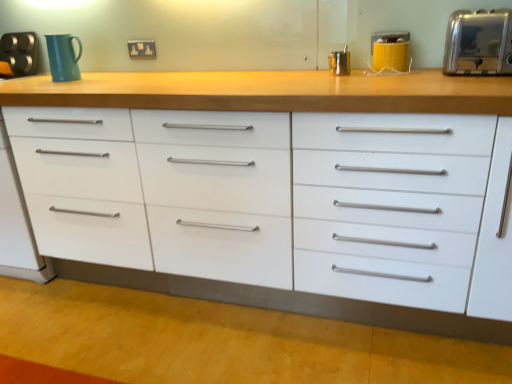
How much space does satin silver toaster at upper right, which is the 4th appliance from left to right, occupy vertically?

The height of satin silver toaster at upper right, which is the 4th appliance from left to right, is 7.89 inches.

What are the coordinates of `brushed metal toaster at upper left, positioned as the first appliance in left-to-right order` in the screenshot? It's located at (19, 52).

What do you see at coordinates (390, 50) in the screenshot? The width and height of the screenshot is (512, 384). I see `yellow matte toaster at upper right, which is the 2th appliance from front to back` at bounding box center [390, 50].

This screenshot has height=384, width=512. I want to click on satin silver toaster at upper right, which is the first appliance from right to left, so click(x=479, y=43).

Consider the image. Is matte plastic electric outlet at upper center aimed at brushed metal toaster at upper left, positioned as the first appliance in left-to-right order?

No, matte plastic electric outlet at upper center is not aimed at brushed metal toaster at upper left, positioned as the first appliance in left-to-right order.

Is matte plastic electric outlet at upper center located outside brushed metal toaster at upper left, marked as the 4th appliance in a front-to-back arrangement?

Indeed, matte plastic electric outlet at upper center is completely outside brushed metal toaster at upper left, marked as the 4th appliance in a front-to-back arrangement.

Looking at their sizes, would you say matte plastic electric outlet at upper center is wider or thinner than brushed metal toaster at upper left, positioned as the first appliance in back-to-front order?

Considering their sizes, matte plastic electric outlet at upper center looks slimmer than brushed metal toaster at upper left, positioned as the first appliance in back-to-front order.

Can you confirm if matte plastic electric outlet at upper center is smaller than brushed metal toaster at upper left, positioned as the first appliance in back-to-front order?

Yes.

Would you say satin silver toaster at upper right, which is the 4th appliance from left to right, is part of matte plastic electric outlet at upper center's contents?

That's incorrect, satin silver toaster at upper right, which is the 4th appliance from left to right, is not inside matte plastic electric outlet at upper center.

Is matte plastic electric outlet at upper center oriented towards satin silver toaster at upper right, which is the first appliance from right to left?

No.

Is matte plastic electric outlet at upper center in front of satin silver toaster at upper right, which is the 4th appliance from left to right?

No, matte plastic electric outlet at upper center is behind satin silver toaster at upper right, which is the 4th appliance from left to right.

Can you confirm if matte plastic electric outlet at upper center is wider than satin silver toaster at upper right, which is the 4th appliance from back to front?

In fact, matte plastic electric outlet at upper center might be narrower than satin silver toaster at upper right, which is the 4th appliance from back to front.

Based on the photo, is white glossy chest of drawers at center to the right of metallic silver container at upper center, which ranks as the 2th appliance in back-to-front order, from the viewer's perspective?

No, white glossy chest of drawers at center is not to the right of metallic silver container at upper center, which ranks as the 2th appliance in back-to-front order.

Could you tell me if white glossy chest of drawers at center is turned towards metallic silver container at upper center, which is counted as the 3th appliance, starting from the right?

No, white glossy chest of drawers at center is not turned towards metallic silver container at upper center, which is counted as the 3th appliance, starting from the right.

Consider the image. Would you say white glossy chest of drawers at center is a long distance from metallic silver container at upper center, the second appliance when ordered from left to right?

That's not correct — white glossy chest of drawers at center is a little close to metallic silver container at upper center, the second appliance when ordered from left to right.

From the image's perspective, is white glossy chest of drawers at center located above metallic silver container at upper center, which ranks as the 2th appliance in back-to-front order?

No, from the image's perspective, white glossy chest of drawers at center is not over metallic silver container at upper center, which ranks as the 2th appliance in back-to-front order.

Consider the image. From a real-world perspective, is matte plastic electric outlet at upper center positioned above or below metallic silver container at upper center, which is counted as the 3th appliance, starting from the right?

matte plastic electric outlet at upper center is above metallic silver container at upper center, which is counted as the 3th appliance, starting from the right.

Considering the sizes of objects matte plastic electric outlet at upper center and metallic silver container at upper center, the second appliance when ordered from left to right, in the image provided, who is shorter, matte plastic electric outlet at upper center or metallic silver container at upper center, the second appliance when ordered from left to right,?

Standing shorter between the two is matte plastic electric outlet at upper center.

At what (x,y) coordinates should I click in order to perform the action: click on electric outlet above the metallic silver container at upper center, which is counted as the 3th appliance, starting from the right (from a real-world perspective). Please return your answer as a coordinate pair (x, y). Image resolution: width=512 pixels, height=384 pixels. Looking at the image, I should click on click(142, 49).

Considering the positions of objects matte plastic electric outlet at upper center and metallic silver container at upper center, which ranks as the 2th appliance in back-to-front order, in the image provided, who is more to the left, matte plastic electric outlet at upper center or metallic silver container at upper center, which ranks as the 2th appliance in back-to-front order,?

matte plastic electric outlet at upper center.

Based on the photo, considering the sizes of objects matte teal mug at upper left and matte plastic electric outlet at upper center in the image provided, who is thinner, matte teal mug at upper left or matte plastic electric outlet at upper center?

matte plastic electric outlet at upper center.

Could you tell me if matte teal mug at upper left is turned towards matte plastic electric outlet at upper center?

No, matte teal mug at upper left is not oriented towards matte plastic electric outlet at upper center.

From the image's perspective, which object appears higher, matte teal mug at upper left or matte plastic electric outlet at upper center?

From the image's view, matte plastic electric outlet at upper center is above.

You are a GUI agent. You are given a task and a screenshot of the screen. Output one action in this format:
    pyautogui.click(x=<x>, y=<y>)
    Task: Click on the 2nd appliance behind the white glossy chest of drawers at center
    The image size is (512, 384).
    Given the screenshot: What is the action you would take?
    [x=390, y=50]

From a real-world perspective, who is located higher, yellow matte toaster at upper right, the second appliance in the right-to-left sequence, or white glossy chest of drawers at center?

yellow matte toaster at upper right, the second appliance in the right-to-left sequence.

Who is bigger, yellow matte toaster at upper right, the third appliance when ordered from back to front, or white glossy chest of drawers at center?

Bigger between the two is white glossy chest of drawers at center.

Is matte plastic electric outlet at upper center at the back of brushed metal toaster at upper left, positioned as the first appliance in back-to-front order?

No, matte plastic electric outlet at upper center is not at the back of brushed metal toaster at upper left, positioned as the first appliance in back-to-front order.

From a real-world perspective, is brushed metal toaster at upper left, positioned as the first appliance in back-to-front order, located beneath matte plastic electric outlet at upper center?

Yes.

Can you confirm if brushed metal toaster at upper left, marked as the fourth appliance in a right-to-left arrangement, is smaller than matte plastic electric outlet at upper center?

Incorrect, brushed metal toaster at upper left, marked as the fourth appliance in a right-to-left arrangement, is not smaller in size than matte plastic electric outlet at upper center.

Looking at this image, can we say brushed metal toaster at upper left, marked as the fourth appliance in a right-to-left arrangement, lies outside matte plastic electric outlet at upper center?

brushed metal toaster at upper left, marked as the fourth appliance in a right-to-left arrangement, is positioned outside matte plastic electric outlet at upper center.

At what (x,y) coordinates should I click in order to perform the action: click on appliance behind the matte plastic electric outlet at upper center. Please return your answer as a coordinate pair (x, y). Image resolution: width=512 pixels, height=384 pixels. Looking at the image, I should click on (19, 52).

At what (x,y) coordinates should I click in order to perform the action: click on appliance that is the 2nd object located below the matte plastic electric outlet at upper center (from the image's perspective). Please return your answer as a coordinate pair (x, y). The image size is (512, 384). Looking at the image, I should click on (479, 43).

When comparing their distances from matte teal mug at upper left, does metallic silver container at upper center, the 3th appliance when ordered from front to back, or white glossy chest of drawers at center seem closer?

white glossy chest of drawers at center is closer to matte teal mug at upper left.

Looking at the image, which one is located further to satin silver toaster at upper right, the 1th appliance in the front-to-back sequence, yellow matte toaster at upper right, the second appliance in the right-to-left sequence, or brushed metal toaster at upper left, marked as the 4th appliance in a front-to-back arrangement?

Among the two, brushed metal toaster at upper left, marked as the 4th appliance in a front-to-back arrangement, is located further to satin silver toaster at upper right, the 1th appliance in the front-to-back sequence.

Based on the photo, from the image, which object appears to be farther from brushed metal toaster at upper left, marked as the fourth appliance in a right-to-left arrangement, metallic silver container at upper center, the second appliance when ordered from left to right, or white glossy chest of drawers at center?

Based on the image, metallic silver container at upper center, the second appliance when ordered from left to right, appears to be further to brushed metal toaster at upper left, marked as the fourth appliance in a right-to-left arrangement.

From the image, which object appears to be farther from white glossy chest of drawers at center, brushed metal toaster at upper left, marked as the fourth appliance in a right-to-left arrangement, or yellow matte toaster at upper right, marked as the 3th appliance in a left-to-right arrangement?

Among the two, brushed metal toaster at upper left, marked as the fourth appliance in a right-to-left arrangement, is located further to white glossy chest of drawers at center.

From the image, which object appears to be nearer to matte teal mug at upper left, brushed metal toaster at upper left, positioned as the first appliance in left-to-right order, or matte plastic electric outlet at upper center?

matte plastic electric outlet at upper center lies closer to matte teal mug at upper left than the other object.

Estimate the real-world distances between objects in this image. Which object is closer to yellow matte toaster at upper right, the second appliance in the right-to-left sequence, matte plastic electric outlet at upper center or satin silver toaster at upper right, which is the first appliance from right to left?

satin silver toaster at upper right, which is the first appliance from right to left, is closer to yellow matte toaster at upper right, the second appliance in the right-to-left sequence.

When comparing their distances from brushed metal toaster at upper left, positioned as the first appliance in left-to-right order, does matte plastic electric outlet at upper center or satin silver toaster at upper right, which is the 4th appliance from back to front, seem further?

The object further to brushed metal toaster at upper left, positioned as the first appliance in left-to-right order, is satin silver toaster at upper right, which is the 4th appliance from back to front.

Based on their spatial positions, is matte plastic electric outlet at upper center or satin silver toaster at upper right, which is the 4th appliance from back to front, closer to matte teal mug at upper left?

matte plastic electric outlet at upper center.

I want to click on mug between brushed metal toaster at upper left, marked as the 4th appliance in a front-to-back arrangement, and metallic silver container at upper center, the second appliance when ordered from left to right, so click(63, 57).

Locate an element on the screen. Image resolution: width=512 pixels, height=384 pixels. chest of drawers between brushed metal toaster at upper left, marked as the fourth appliance in a right-to-left arrangement, and satin silver toaster at upper right, the 1th appliance in the front-to-back sequence is located at coordinates (266, 213).

Where is `mug between brushed metal toaster at upper left, marked as the fourth appliance in a right-to-left arrangement, and yellow matte toaster at upper right, the third appliance when ordered from back to front`? mug between brushed metal toaster at upper left, marked as the fourth appliance in a right-to-left arrangement, and yellow matte toaster at upper right, the third appliance when ordered from back to front is located at coordinates 63,57.

Find the location of `electric outlet between matte teal mug at upper left and yellow matte toaster at upper right, the third appliance when ordered from back to front, in the horizontal direction`. electric outlet between matte teal mug at upper left and yellow matte toaster at upper right, the third appliance when ordered from back to front, in the horizontal direction is located at coordinates (142, 49).